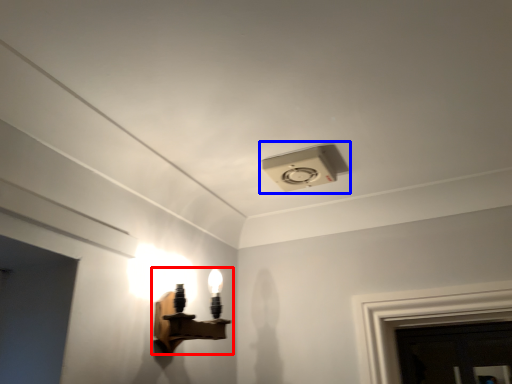
Question: Which object appears closest to the camera in this image, lamp (highlighted by a red box) or lamp (highlighted by a blue box)?

Choices:
 (A) lamp
 (B) lamp

Answer: (A)